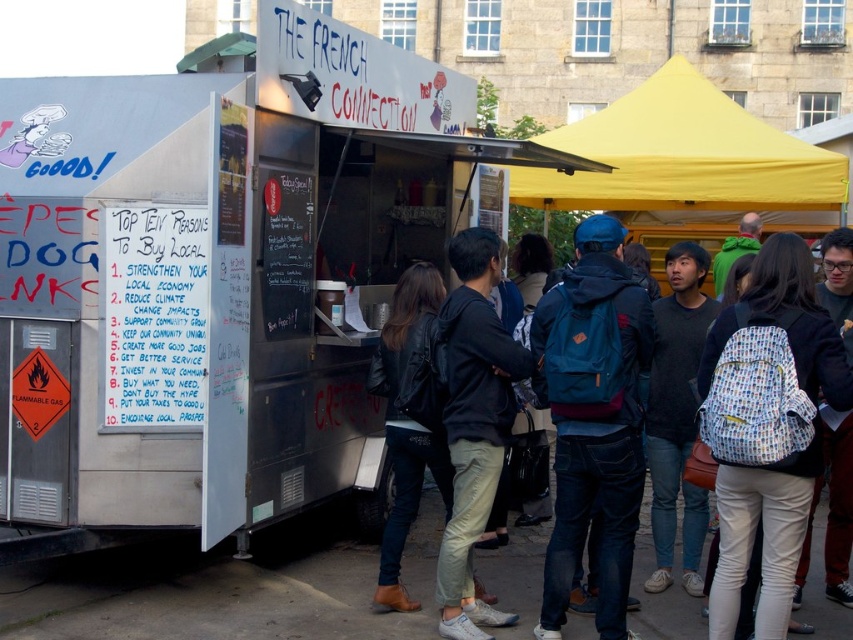
Question: Can you confirm if blue backpack at center is positioned to the left of yellow fabric canopy at upper right?

Choices:
 (A) no
 (B) yes

Answer: (B)

Question: Which of these objects is positioned farthest from the blue backpack at center?

Choices:
 (A) light beige pants at center
 (B) yellow fabric canopy at upper right
 (C) metallic silver food truck at center

Answer: (B)

Question: Which point is farther to the camera?

Choices:
 (A) yellow fabric canopy at upper right
 (B) metallic silver food truck at center
 (C) light beige pants at center

Answer: (A)

Question: Is metallic silver food truck at center further to camera compared to blue backpack at center?

Choices:
 (A) no
 (B) yes

Answer: (B)

Question: Can you confirm if metallic silver food truck at center is positioned to the right of blue backpack at center?

Choices:
 (A) no
 (B) yes

Answer: (A)

Question: Which object appears closest to the camera in this image?

Choices:
 (A) light beige pants at center
 (B) yellow fabric canopy at upper right

Answer: (A)